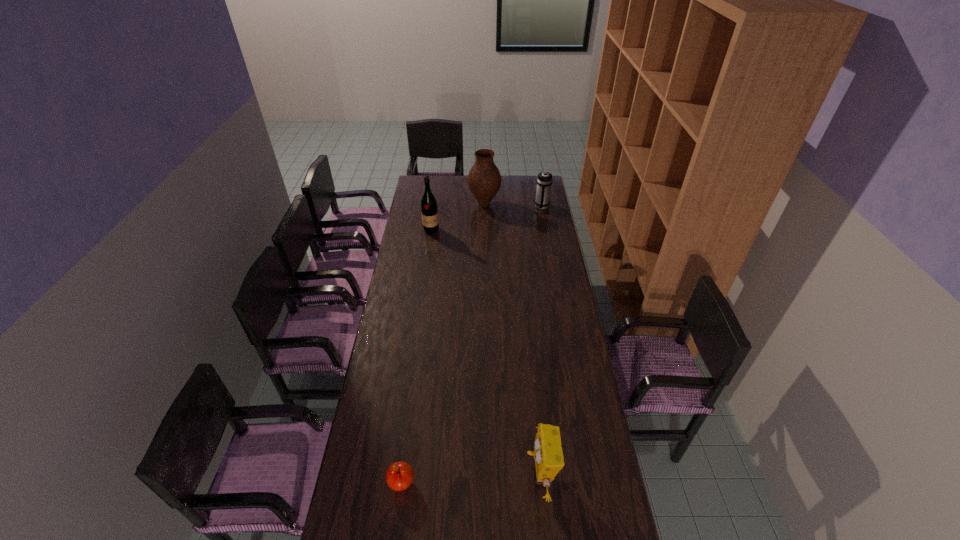
In order to click on vacant space situated 0.130m on the face of the sponge in this screenshot , I will do `click(485, 475)`.

This screenshot has height=540, width=960. Identify the location of blank space located 0.340m on the right of the apple. (519, 483).

Locate an element on the screen. Image resolution: width=960 pixels, height=540 pixels. liquor at the left edge is located at coordinates (429, 210).

Find the location of `apple that is at the left edge`. apple that is at the left edge is located at coordinates (399, 476).

In order to click on object that is at the right edge in this screenshot , I will do `click(544, 181)`.

This screenshot has height=540, width=960. In the image, there is a desktop. Find the location of `free region at the far edge`. free region at the far edge is located at coordinates (505, 180).

Locate an element on the screen. The image size is (960, 540). free location at the left edge of the desktop is located at coordinates (397, 403).

In the image, there is a desktop. Identify the location of free region at the right edge. (596, 431).

Find the location of a particular element. This screenshot has height=540, width=960. vacant area at the far left corner of the desktop is located at coordinates (422, 181).

The width and height of the screenshot is (960, 540). What are the coordinates of `vacant space that is in between the liquor and the shortest object` in the screenshot? It's located at (417, 356).